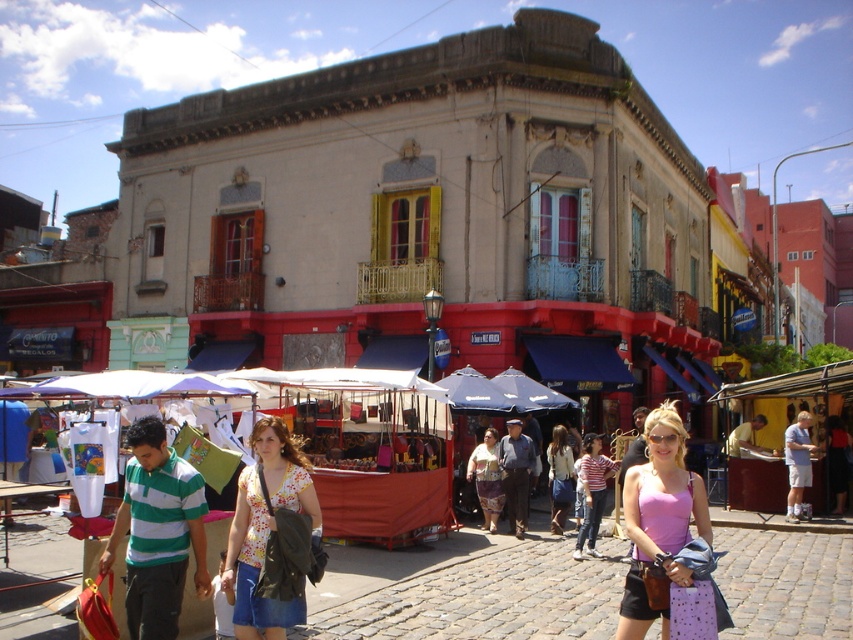
You are a tourist standing in the street scene and want to take a photo of both the historic building and the market stalls. You notice two specific points of interest marked as point 1 at coordinates point [496,515] and point 2 at coordinates point [552,492]. Which point is closer to you, the tourist?

Point [496,515] is closer to you than point [552,492] because it is further to the viewer.

You are standing in the middle of the street looking at the historic building and the market stalls. There are two points marked on the image. The first point is at coordinates point (x=640, y=612) and the second point is at point (x=480, y=442). Which point is closer to you?

Point (x=640, y=612) is closer to the camera than point (x=480, y=442).

You are a customer looking for a pink fabric tank top. The market has stalls with blue and white canopies. Where should you look to find the pink fabric tank top at center?

The pink fabric tank top at center is located at point (659, 518), which corresponds to the central area of the market stalls under the blue and white canopies.